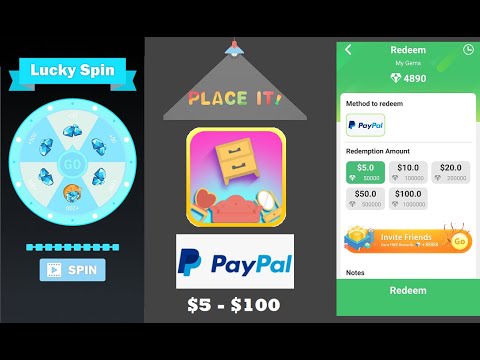
Can you point out all where you sit on couch in this image? Your answer should be formatted as a list of tuples, i.e. [(x1, y1), (x2, y2), ...], where each tuple contains the x and y coordinates of a point satisfying the conditions above.

[(232, 214)]